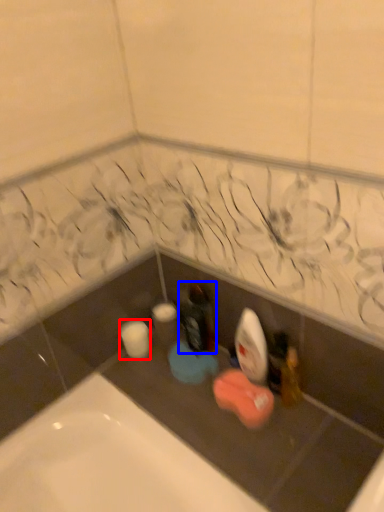
Question: Which object is closer to the camera taking this photo, toilet paper (highlighted by a red box) or bottle (highlighted by a blue box)?

Choices:
 (A) toilet paper
 (B) bottle

Answer: (B)